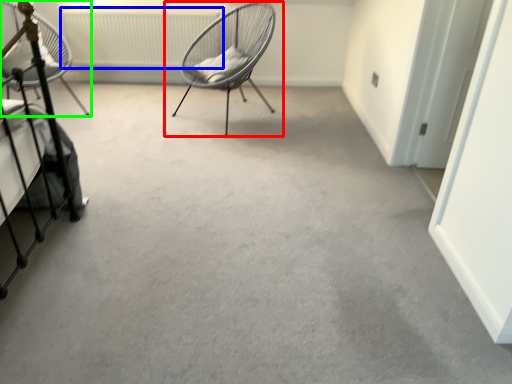
Question: Considering the real-world distances, which object is farthest from chair (highlighted by a red box)? radiator (highlighted by a blue box) or chair (highlighted by a green box)?

Choices:
 (A) radiator
 (B) chair

Answer: (B)